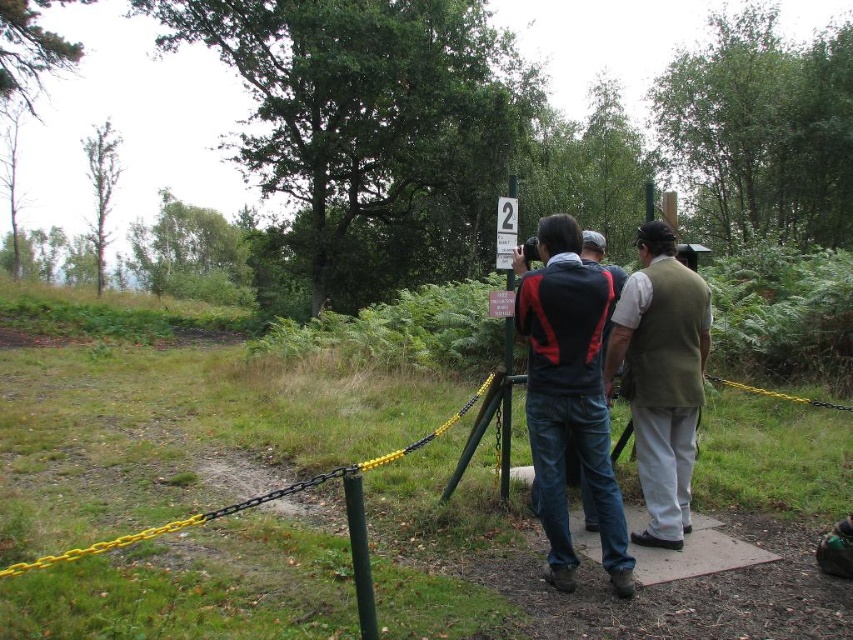
Question: Can you confirm if khaki cotton vest at center is positioned to the left of white plastic sign at center?

Choices:
 (A) no
 (B) yes

Answer: (A)

Question: Where is dark blue jacket at center located in relation to green metallic pole at center in the image?

Choices:
 (A) below
 (B) above

Answer: (A)

Question: Estimate the real-world distances between objects in this image. Which object is closer to the khaki cotton vest at center?

Choices:
 (A) green matte pole at lower center
 (B) dark blue jacket at center
 (C) white plastic sign at center
 (D) green metallic pole at center

Answer: (B)

Question: Does green metallic pole at center appear under white plastic sign at center?

Choices:
 (A) yes
 (B) no

Answer: (A)

Question: Which point is farther to the camera?

Choices:
 (A) (579, 275)
 (B) (344, 492)

Answer: (B)

Question: Which point is farther to the camera?

Choices:
 (A) green matte pole at lower center
 (B) green metallic pole at center
 (C) dark blue jacket at center

Answer: (B)